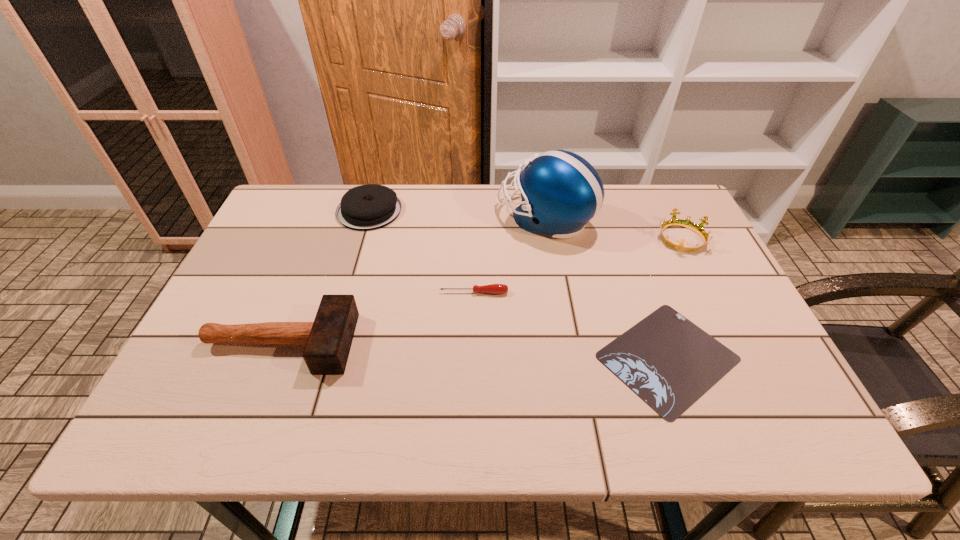
Find the location of a particular element. free space located on the hammer head face of the mallet is located at coordinates pyautogui.click(x=510, y=343).

The height and width of the screenshot is (540, 960). Identify the location of vacant area located on the front of the pancake. (359, 245).

The width and height of the screenshot is (960, 540). I want to click on blank area located on the front of the crown, so click(x=746, y=369).

Find the location of a particular element. The width and height of the screenshot is (960, 540). vacant region located 0.200m on the back of the second shortest object is located at coordinates click(474, 239).

This screenshot has width=960, height=540. Find the location of `vacant space situated 0.360m on the left of the mousepad`. vacant space situated 0.360m on the left of the mousepad is located at coordinates (434, 357).

The width and height of the screenshot is (960, 540). In order to click on football helmet located in the far edge section of the desktop in this screenshot , I will do `click(561, 192)`.

Find the location of a particular element. The width and height of the screenshot is (960, 540). pancake that is at the far edge is located at coordinates (367, 207).

Where is `crown located in the far edge section of the desktop`? This screenshot has height=540, width=960. crown located in the far edge section of the desktop is located at coordinates (686, 223).

Identify the location of object located in the near edge section of the desktop. (669, 362).

You are a GUI agent. You are given a task and a screenshot of the screen. Output one action in this format:
    pyautogui.click(x=<x>, y=<y>)
    Task: Click on the object situated at the left edge
    This screenshot has width=960, height=540.
    Given the screenshot: What is the action you would take?
    pyautogui.click(x=328, y=339)